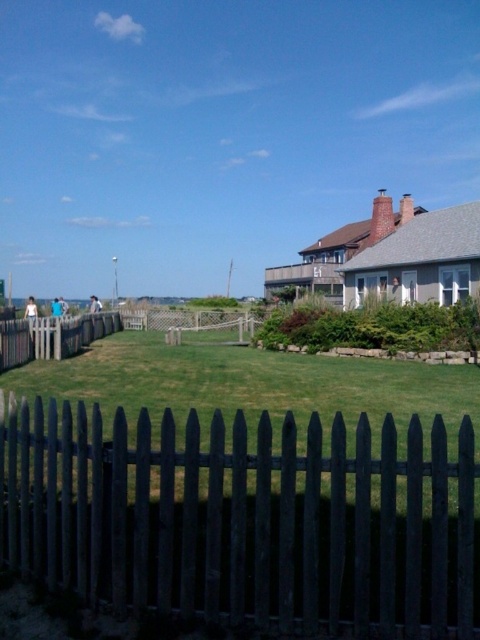
Which is below, green grass at center or wooden picket fence at center?

green grass at center is below.

Where is `green grass at center`? green grass at center is located at coordinates (252, 381).

Is point (274, 388) behind point (97, 328)?

No, (274, 388) is in front of (97, 328).

Where is `green grass at center`? Image resolution: width=480 pixels, height=640 pixels. green grass at center is located at coordinates (x=252, y=381).

Can you confirm if dark wood picket fence at center is positioned above wooden picket fence at center?

Actually, dark wood picket fence at center is below wooden picket fence at center.

Does dark wood picket fence at center have a smaller size compared to wooden picket fence at center?

Yes.

Which is in front, point (206, 509) or point (40, 326)?

Point (206, 509) is more forward.

What are the coordinates of `dark wood picket fence at center` in the screenshot? It's located at (243, 522).

You are a GUI agent. You are given a task and a screenshot of the screen. Output one action in this format:
    pyautogui.click(x=<x>, y=<y>)
    Task: Click on the dark wood picket fence at center
    The width and height of the screenshot is (480, 640).
    Given the screenshot: What is the action you would take?
    pyautogui.click(x=243, y=522)

Does dark wood picket fence at center have a greater width compared to green grass at center?

Incorrect, dark wood picket fence at center's width does not surpass green grass at center's.

This screenshot has width=480, height=640. I want to click on dark wood picket fence at center, so click(243, 522).